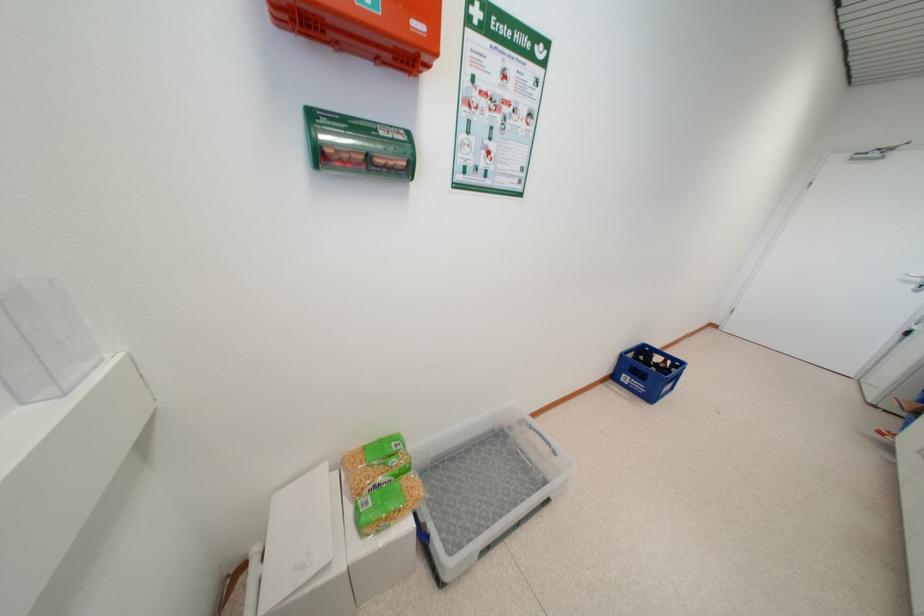
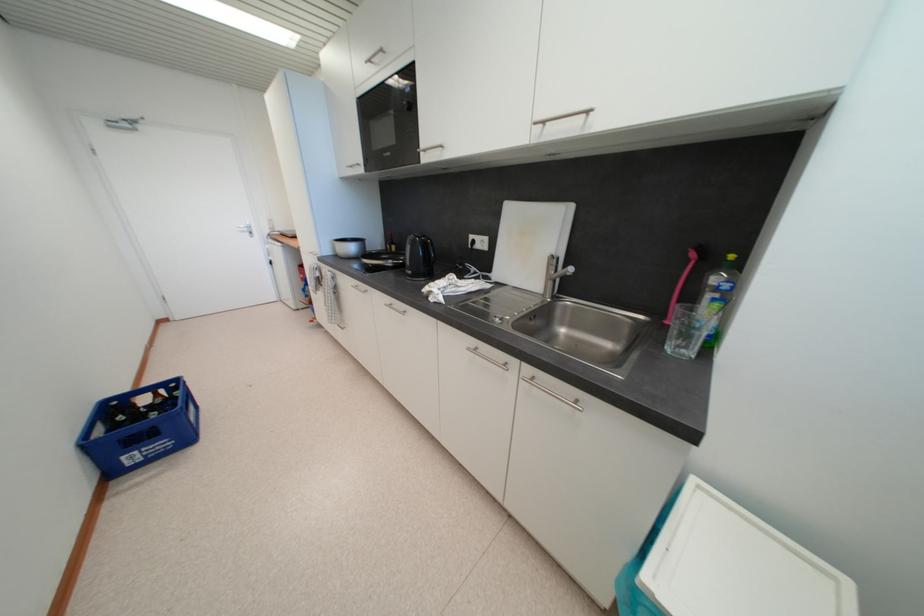
The first image is from the beginning of the video and the second image is from the end. How did the camera likely rotate when shooting the video?

The camera's rotation is toward right-down.